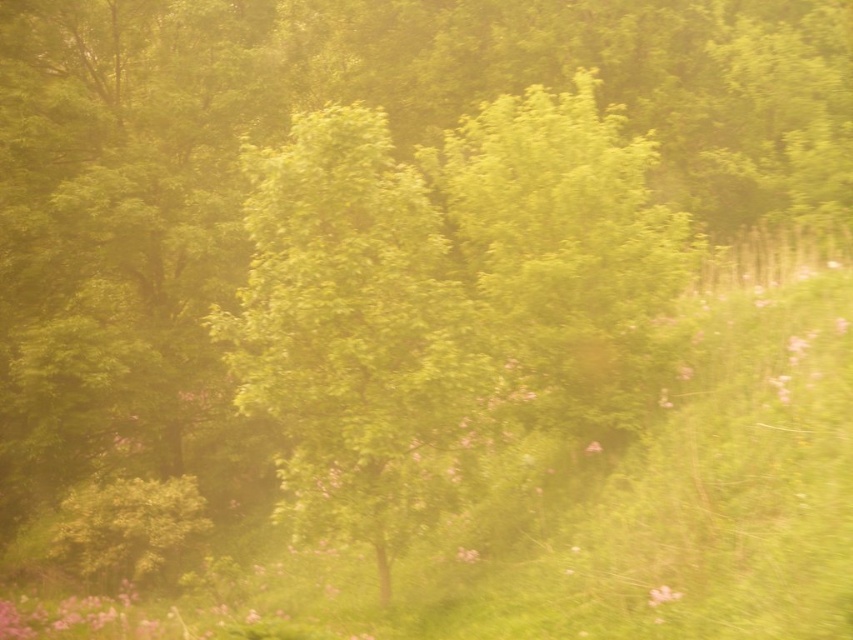
You are a gardener who wants to plant a new flower bed between the green leafy tree at center and the soft pink petals at center. What should you consider about their widths?

The green leafy tree at center might be wider than the soft pink petals at center, so you should ensure there is enough space between them to accommodate the tree.

You are a bird looking for a place to perch. You see the green leafy tree at center and the soft pink petals at center. Which one is taller?

The green leafy tree at center is taller than the soft pink petals at center, so you should choose the green leafy tree at center to perch.